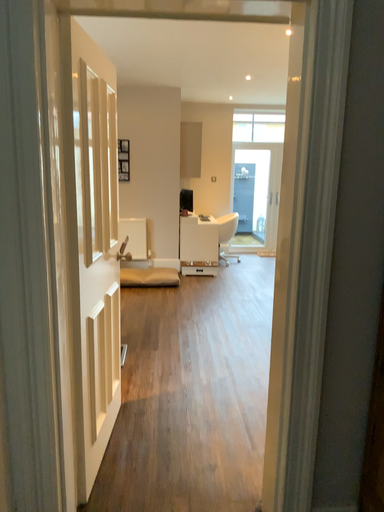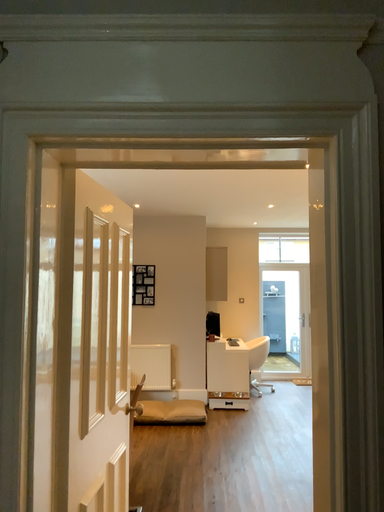
Question: Which way did the camera rotate in the video?

Choices:
 (A) rotated upward
 (B) rotated downward

Answer: (A)